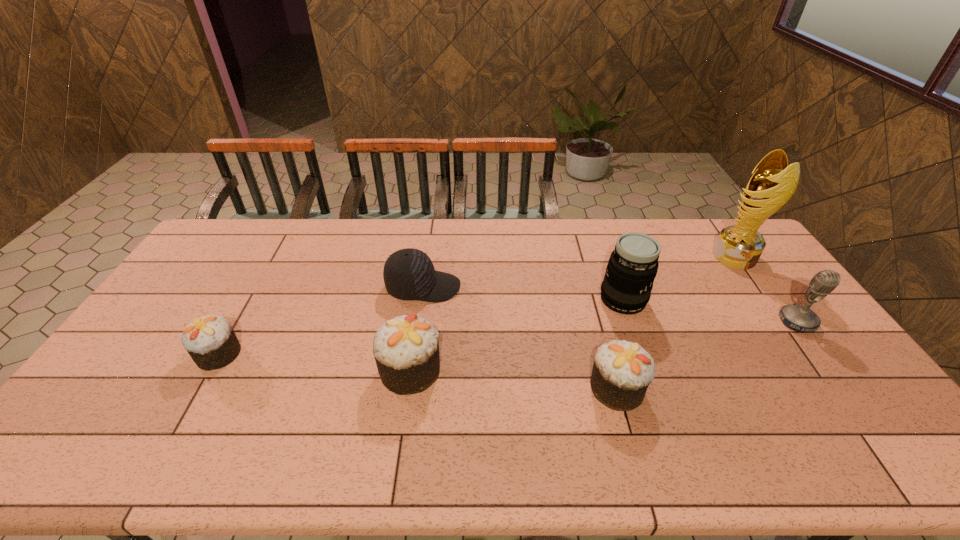
Observe the arrangement of all cupcakes in the image. To keep them evenly spaced, where would you place another cupcake on the right? Please locate a free space. Please provide its 2D coordinates. Your answer should be formatted as a tuple, i.e. [(x, y)], where the tuple contains the x and y coordinates of a point satisfying the conditions above.

[(839, 408)]